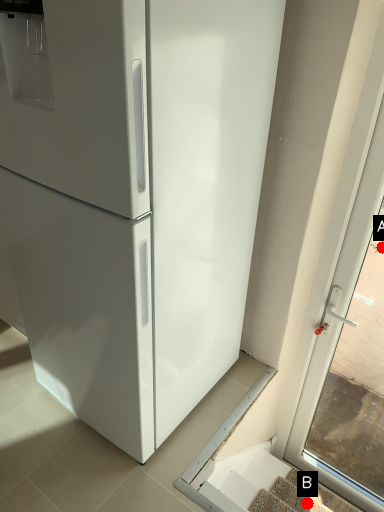
Question: Two points are circled on the image, labeled by A and B beside each circle. Which point is further to the camera?

Choices:
 (A) A is further
 (B) B is further

Answer: (A)